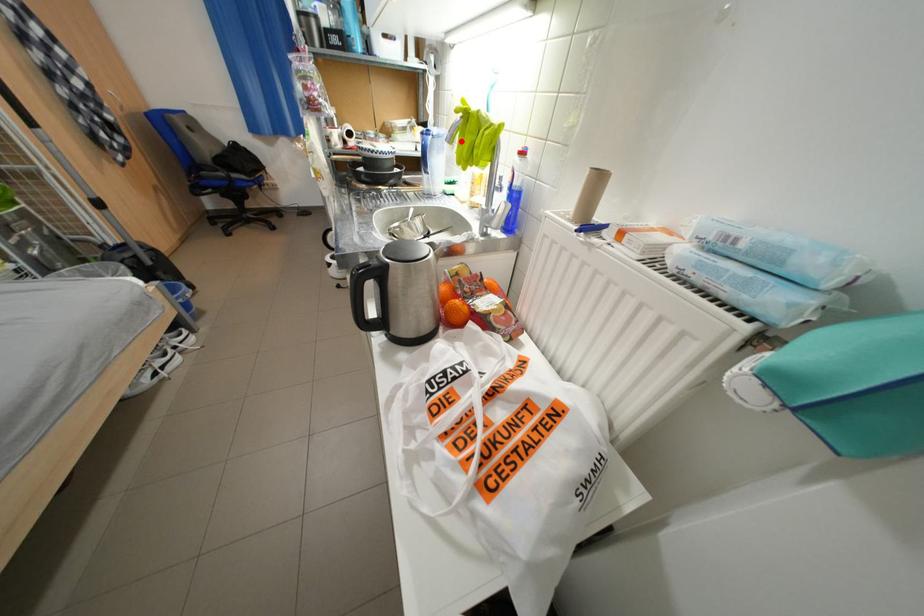
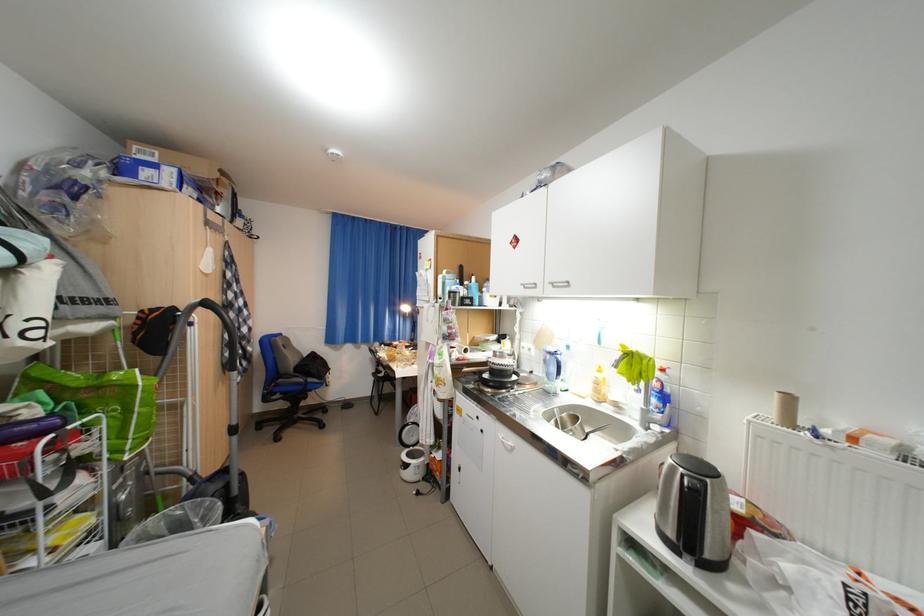
Where in the second image is the point corresponding to the highlighted location from the first image?

(627, 368)